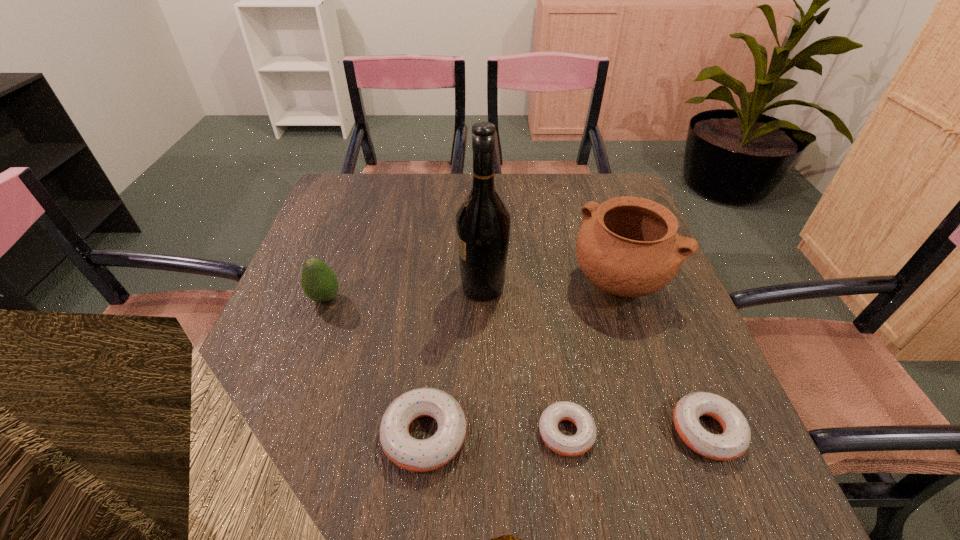
In order to click on free space located 0.400m on the back of the leftmost doughnut in this screenshot , I will do `click(442, 259)`.

Where is `vacant space positioned on the back of the shortest doughnut`? This screenshot has height=540, width=960. vacant space positioned on the back of the shortest doughnut is located at coordinates (549, 322).

Find the location of `free point located 0.140m on the back of the rightmost doughnut`. free point located 0.140m on the back of the rightmost doughnut is located at coordinates (671, 341).

Where is `free point located on the label of the tallest object`? free point located on the label of the tallest object is located at coordinates [x=306, y=288].

The image size is (960, 540). I want to click on free space located 0.380m on the label of the tallest object, so click(299, 288).

Find the location of a particular element. Image resolution: width=960 pixels, height=540 pixels. free space located on the label of the tallest object is located at coordinates (348, 288).

The image size is (960, 540). Identify the location of vacant space located 0.120m on the left of the pottery. (520, 284).

Locate an element on the screen. This screenshot has height=540, width=960. vacant space located 0.190m on the front of the third tallest object is located at coordinates (295, 382).

Identify the location of object at the left edge. Image resolution: width=960 pixels, height=540 pixels. (319, 282).

Locate an element on the screen. The width and height of the screenshot is (960, 540). doughnut located in the right edge section of the desktop is located at coordinates (734, 441).